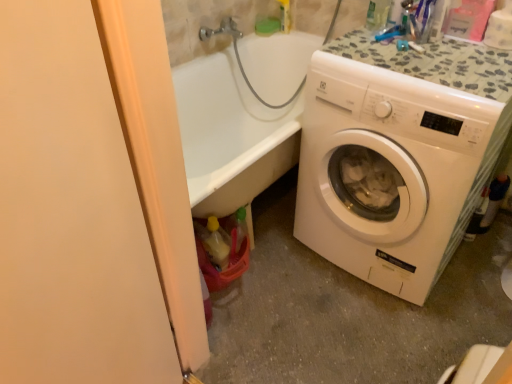
Question: Looking at their shapes, would you say white plastic washing machine at right is wider or thinner than matte peach screen door at left?

Choices:
 (A) thin
 (B) wide

Answer: (B)

Question: Considering the positions of white plastic washing machine at right and matte peach screen door at left in the image, is white plastic washing machine at right taller or shorter than matte peach screen door at left?

Choices:
 (A) tall
 (B) short

Answer: (B)

Question: Is white plastic washing machine at right in front of or behind matte peach screen door at left in the image?

Choices:
 (A) behind
 (B) front

Answer: (A)

Question: In terms of size, does matte peach screen door at left appear bigger or smaller than white plastic washing machine at right?

Choices:
 (A) small
 (B) big

Answer: (A)

Question: In terms of width, does matte peach screen door at left look wider or thinner when compared to white plastic washing machine at right?

Choices:
 (A) wide
 (B) thin

Answer: (B)

Question: Considering the relative positions of matte peach screen door at left and white plastic washing machine at right in the image provided, is matte peach screen door at left to the left or to the right of white plastic washing machine at right?

Choices:
 (A) left
 (B) right

Answer: (A)

Question: Is matte peach screen door at left inside or outside of white plastic washing machine at right?

Choices:
 (A) inside
 (B) outside

Answer: (B)